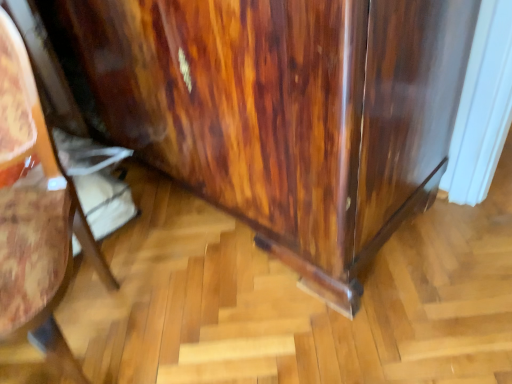
Identify the location of empty space that is to the right of glossy wood cabinet at lower right. (197, 303).